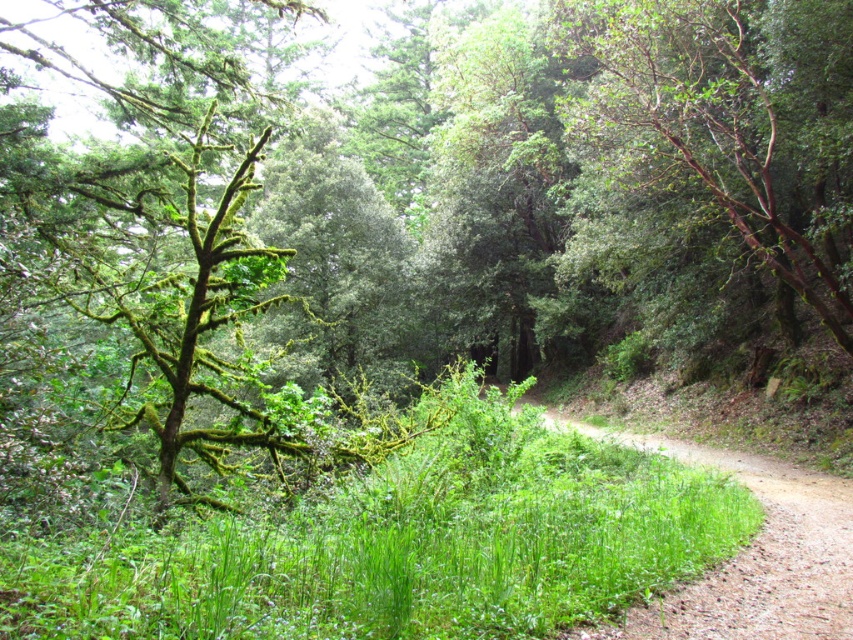
Consider the image. You are standing at the edge of the forest and want to reach a specific point marked as point (566,541). If your walking speed is 1.2 meters per second, how many seconds will it take you to reach that point?

The distance to point (566,541) is 5.32 meters. At a speed of 1.2 meters per second, it would take approximately 4.43 seconds to reach the point.

You are standing at the center of the dirt path in the forest scene. You want to take a photo of the brown rough bark tree at upper right. In which direction should you point your camera relative to your position?

The brown rough bark tree at upper right is located at point 2D coordinates of 0.191 on the x axis and 0.857 on the y axis. Since the x coordinate is less than 0.5, the tree is to the left of the center. The y coordinate is greater than 0.5, so it is above the center. Therefore, you should point your camera to the upper left direction relative to your position at the center.

You are a hiker who wants to take a photo of the dirt path at center without the brown rough bark tree at upper right blocking the view. Is it possible to do so by standing at a lower elevation?

The brown rough bark tree at upper right is taller than the dirt path at center, so if you stand at a lower elevation, the tree might still block the view of the dirt path at center depending on the angle and distance. However, moving to a lower position could potentially allow you to frame the shot so the tree is out of the camera frame or partially obscured by other vegetation.